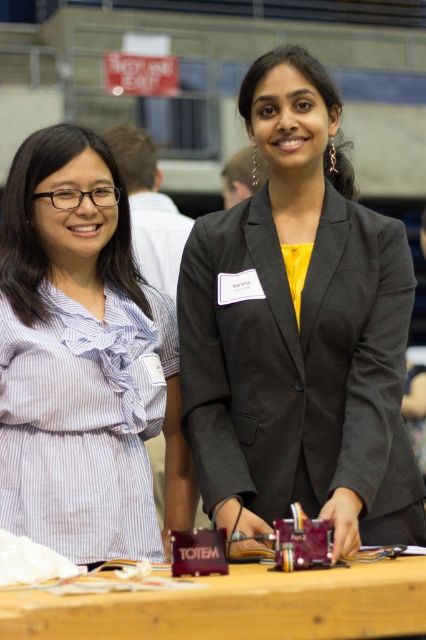
You are organizing a photo shoot and need to place a 1.2 meter wide backdrop between the matte black blazer at center and the white striped shirt at left. Will the backdrop fit between them?

The matte black blazer at center is wider than the white striped shirt at left, so the 1.2 meter backdrop may not fit between them if the distance between the two is less than 1.2 meters. However, the description only mentions their widths, not the actual spacing between them. Without knowing the exact distance between the two individuals, it is impossible to determine if the backdrop will fit.

You are organizing a photo shoot and need to ensure that the matte black blazer at center and the white striped shirt at left are visible in the frame. Given that the camera has a limited focus range, which object should you prioritize to ensure it is in focus first?

The matte black blazer at center should be prioritized to ensure it is in focus first because it has a larger size compared to the white striped shirt at left, making it more prominent in the frame.

Based on the photo, you are organizing a photo shoot and need to ensure that the white striped shirt at left and the wooden table at center are visible in the frame. Given their sizes, which object should you prioritize positioning closer to the camera to maintain clarity?

The white striped shirt at left is larger than the wooden table at center, so positioning it closer to the camera will help maintain clarity while still keeping the table in view.